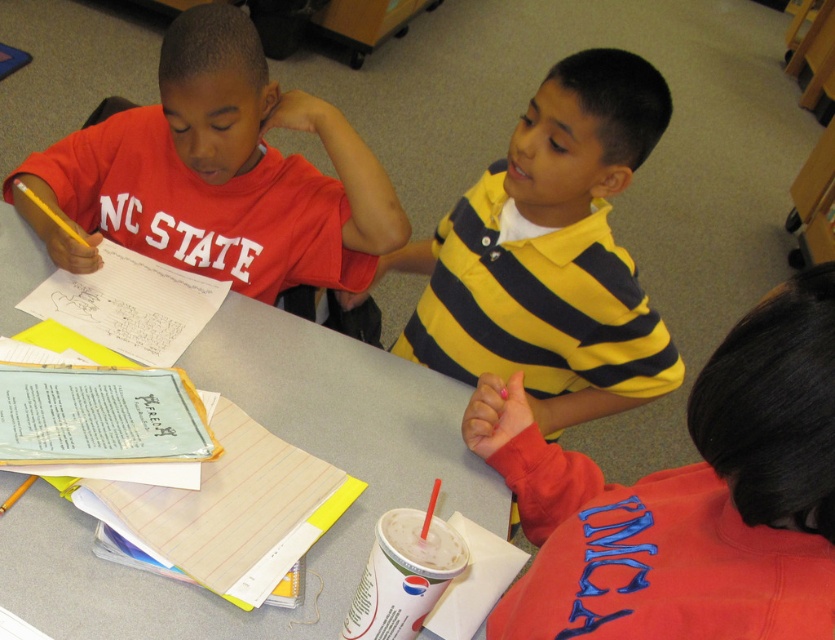
You are standing in the classroom and see two points marked on the table. The first point is at coordinates point (591, 166) and the second is at point (67, 152). If you were to walk towards the table from the front of the classroom, which point would you encounter first?

Point (67, 152) would be encountered first because it is closer to the front of the classroom compared to point (591, 166), which is located further back.